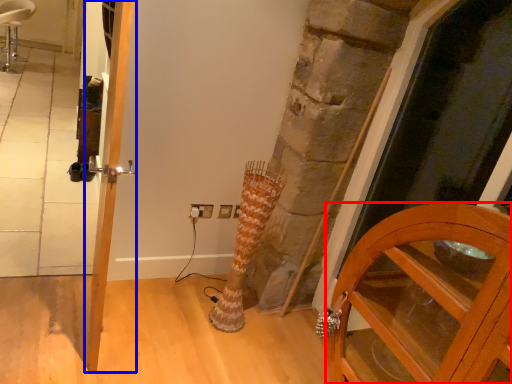
Question: Which object appears closest to the camera in this image, cabinetry (highlighted by a red box) or door (highlighted by a blue box)?

Choices:
 (A) cabinetry
 (B) door

Answer: (A)